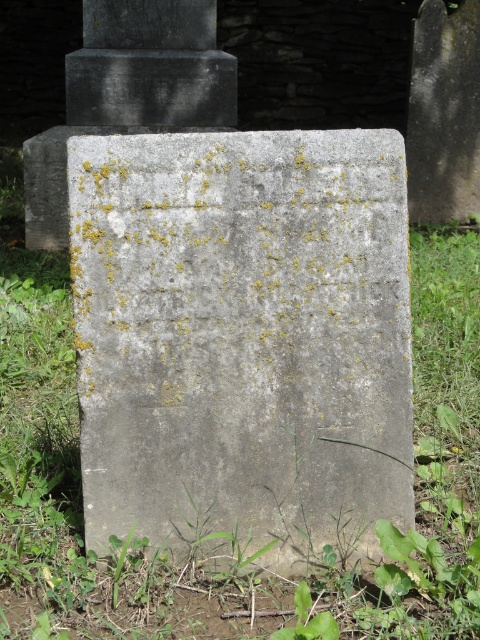
Which of these two, gray stone gravestone at center or green leafy weed at lower center, stands shorter?

Standing shorter between the two is green leafy weed at lower center.

Is point (361, 272) positioned behind point (301, 612)?

Yes, it is behind point (301, 612).

Is point (292, 380) positioned behind point (311, 624)?

Yes, it is behind point (311, 624).

Image resolution: width=480 pixels, height=640 pixels. Find the location of `gray stone gravestone at center`. gray stone gravestone at center is located at coordinates (242, 339).